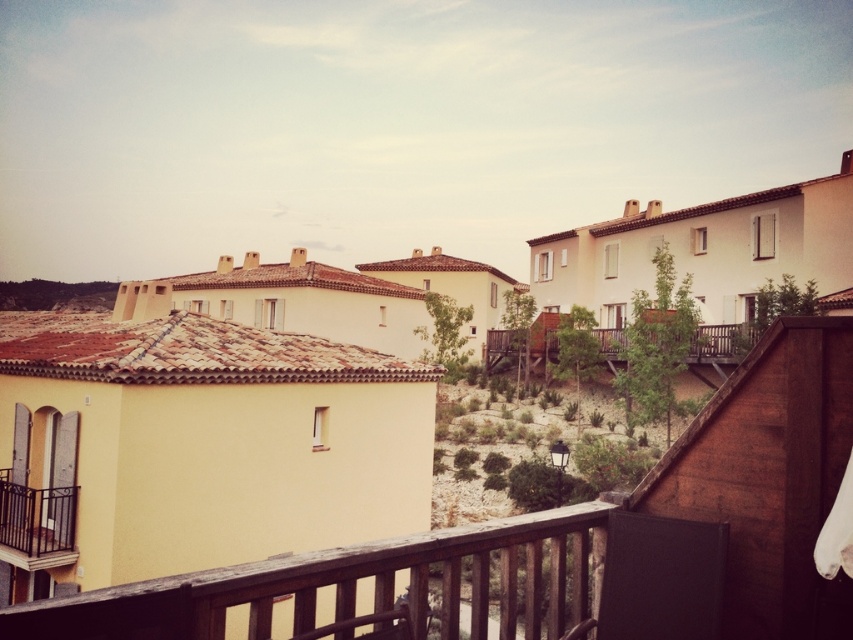
Question: Does wooden at lower center appear over black wrought iron balcony at lower left?

Choices:
 (A) no
 (B) yes

Answer: (A)

Question: Which object appears closest to the camera in this image?

Choices:
 (A) wooden at center
 (B) wooden at lower center
 (C) black wrought iron balcony at lower left

Answer: (B)

Question: Which of the following is the closest to the observer?

Choices:
 (A) black wrought iron balcony at lower left
 (B) wooden at lower center
 (C) wooden at center

Answer: (B)

Question: Which point is farther from the camera taking this photo?

Choices:
 (A) (293, 608)
 (B) (610, 340)
 (C) (67, 550)

Answer: (B)

Question: Can you confirm if wooden at lower center is thinner than wooden at center?

Choices:
 (A) no
 (B) yes

Answer: (B)

Question: Is wooden at lower center behind black wrought iron balcony at lower left?

Choices:
 (A) yes
 (B) no

Answer: (B)